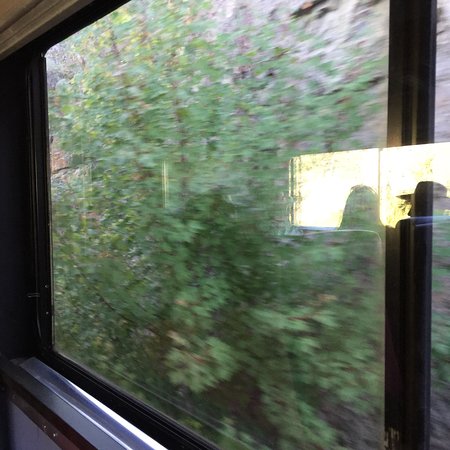
The height and width of the screenshot is (450, 450). What are the coordinates of `glass` in the screenshot? It's located at [x=198, y=254].